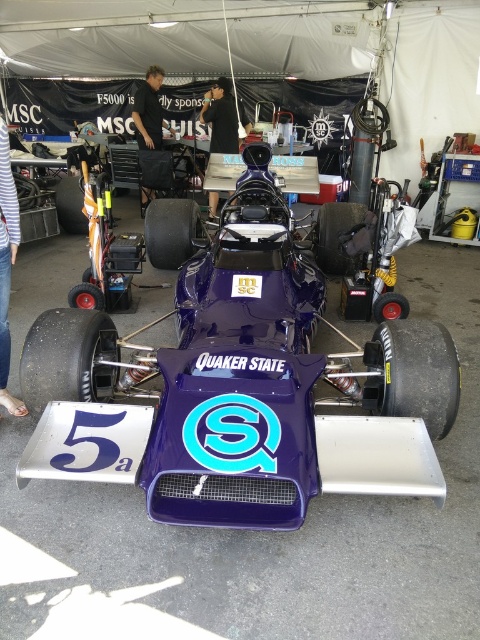
Question: Is the position of striped fabric pants at lower left more distant than that of black fabric at center?

Choices:
 (A) no
 (B) yes

Answer: (A)

Question: Is striped fabric pants at lower left below black fabric shirt at upper center?

Choices:
 (A) no
 (B) yes

Answer: (B)

Question: Which of the following is the closest to the observer?

Choices:
 (A) black fabric at center
 (B) striped fabric pants at lower left
 (C) black fabric shirt at upper center
 (D) purple glossy race car at center

Answer: (D)

Question: Which object appears farthest from the camera in this image?

Choices:
 (A) purple glossy race car at center
 (B) striped fabric pants at lower left

Answer: (B)

Question: Which of the following is the closest to the observer?

Choices:
 (A) [0, 147]
 (B) [303, 266]
 (C) [157, 134]

Answer: (A)

Question: Is striped fabric pants at lower left above black fabric at center?

Choices:
 (A) no
 (B) yes

Answer: (A)